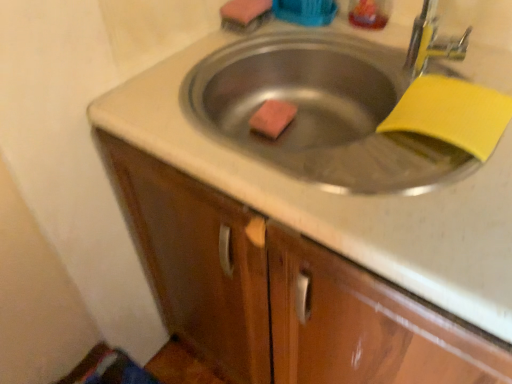
At what (x,y) coordinates should I click in order to perform the action: click on free area in between pink sponge at upper center, which appears as the first soap when viewed from the top, and translucent plastic liquid at upper right. Please return your answer as a coordinate pair (x, y). This screenshot has height=384, width=512. Looking at the image, I should click on (308, 29).